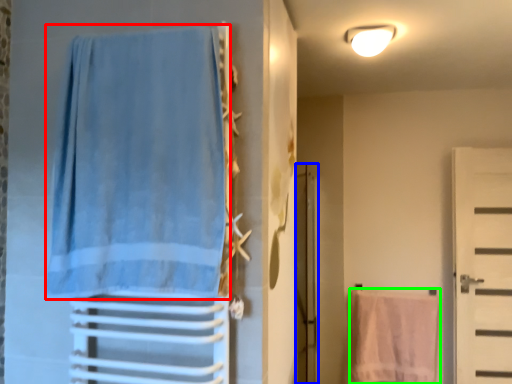
Question: Estimate the real-world distances between objects in this image. Which object is farther from curtain (highlighted by a red box), screen door (highlighted by a blue box) or beach towel (highlighted by a green box)?

Choices:
 (A) screen door
 (B) beach towel

Answer: (B)